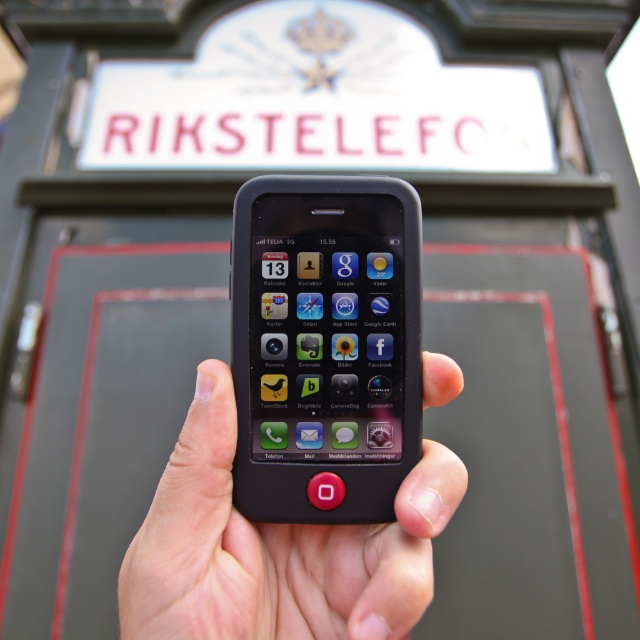
What do you see at coordinates (324, 346) in the screenshot? The height and width of the screenshot is (640, 640). I see `black matte smartphone at center` at bounding box center [324, 346].

Which is more to the left, black matte smartphone at center or black matte phone at center?

Positioned to the left is black matte phone at center.

I want to click on black matte smartphone at center, so click(324, 346).